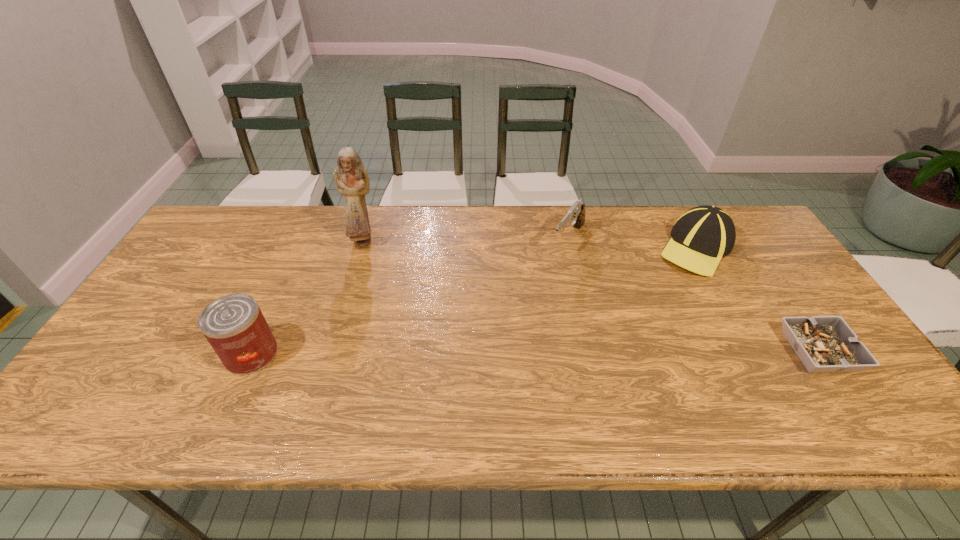
In the image, there is a desktop. Where is `free space at the far right corner`? free space at the far right corner is located at coordinates (761, 246).

This screenshot has width=960, height=540. In the image, there is a desktop. Identify the location of free space at the near right corner. (801, 367).

What are the coordinates of `unoccupied position between the shortest object and the second object from left to right` in the screenshot? It's located at 591,296.

Image resolution: width=960 pixels, height=540 pixels. What are the coordinates of `empty location between the baseball cap and the figurine` in the screenshot? It's located at (530, 245).

What are the coordinates of `empty space between the ashtray and the baseball cap` in the screenshot? It's located at (757, 300).

Identify the location of blank region between the baseball cap and the second object from left to right. Image resolution: width=960 pixels, height=540 pixels. (530, 245).

The height and width of the screenshot is (540, 960). Identify the location of vacant space that's between the baseball cap and the shortest object. (757, 300).

Find the location of a particular element. vacant region between the leftmost object and the figurine is located at coordinates (307, 298).

I want to click on vacant point located between the baseball cap and the fourth object from right to left, so click(x=530, y=245).

This screenshot has width=960, height=540. Find the location of `empty space between the gun and the baseball cap`. empty space between the gun and the baseball cap is located at coordinates (633, 244).